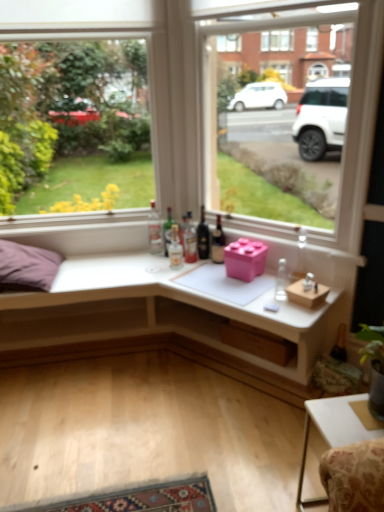
Question: Does wooden at lower center, the first window box positioned from the bottom, appear on the right side of translucent glass bottle at center, marked as the 3th bottle in a left-to-right arrangement?

Choices:
 (A) no
 (B) yes

Answer: (B)

Question: Would you say wooden at lower center, the first window box positioned from the bottom, is a long distance from translucent glass bottle at center, marked as the 3th bottle in a left-to-right arrangement?

Choices:
 (A) yes
 (B) no

Answer: (B)

Question: Can we say wooden at lower center, which appears as the third window box when viewed from the top, lies outside translucent glass bottle at center, marked as the 3th bottle in a left-to-right arrangement?

Choices:
 (A) yes
 (B) no

Answer: (A)

Question: Is translucent glass bottle at center, the 5th bottle when ordered from right to left, at the back of wooden at lower center, which appears as the third window box when viewed from the top?

Choices:
 (A) no
 (B) yes

Answer: (A)

Question: Can you confirm if wooden at lower center, which appears as the third window box when viewed from the top, is smaller than translucent glass bottle at center, marked as the 3th bottle in a left-to-right arrangement?

Choices:
 (A) no
 (B) yes

Answer: (A)

Question: Is translucent glass bottle at center, marked as the sixth bottle in a right-to-left arrangement, inside the boundaries of purple fabric pillow at left, or outside?

Choices:
 (A) outside
 (B) inside

Answer: (A)

Question: Considering the positions of translucent glass bottle at center, which ranks as the 2th bottle in left-to-right order, and purple fabric pillow at left in the image, is translucent glass bottle at center, which ranks as the 2th bottle in left-to-right order, bigger or smaller than purple fabric pillow at left?

Choices:
 (A) big
 (B) small

Answer: (B)

Question: In the image, is translucent glass bottle at center, marked as the sixth bottle in a right-to-left arrangement, positioned in front of or behind purple fabric pillow at left?

Choices:
 (A) behind
 (B) front

Answer: (A)

Question: From their relative heights in the image, would you say translucent glass bottle at center, marked as the sixth bottle in a right-to-left arrangement, is taller or shorter than purple fabric pillow at left?

Choices:
 (A) short
 (B) tall

Answer: (A)

Question: Visually, is dark glass bottle at center, the 6th bottle viewed from the left, positioned to the left or to the right of translucent glass bottle at center, marked as the 3th bottle in a left-to-right arrangement?

Choices:
 (A) left
 (B) right

Answer: (B)

Question: Would you say dark glass bottle at center, the 2th bottle positioned from the right, is inside or outside translucent glass bottle at center, the 5th bottle when ordered from right to left?

Choices:
 (A) outside
 (B) inside

Answer: (A)

Question: Is point (215, 256) closer or farther from the camera than point (168, 254)?

Choices:
 (A) farther
 (B) closer

Answer: (B)

Question: Is dark glass bottle at center, the 2th bottle positioned from the right, wider or thinner than translucent glass bottle at center, marked as the 3th bottle in a left-to-right arrangement?

Choices:
 (A) thin
 (B) wide

Answer: (A)

Question: Is white matte desk at center in front of or behind dark glass bottle at center, which is the 5th bottle in left-to-right order, in the image?

Choices:
 (A) front
 (B) behind

Answer: (A)

Question: Is point (145, 310) closer or farther from the camera than point (203, 211)?

Choices:
 (A) farther
 (B) closer

Answer: (A)